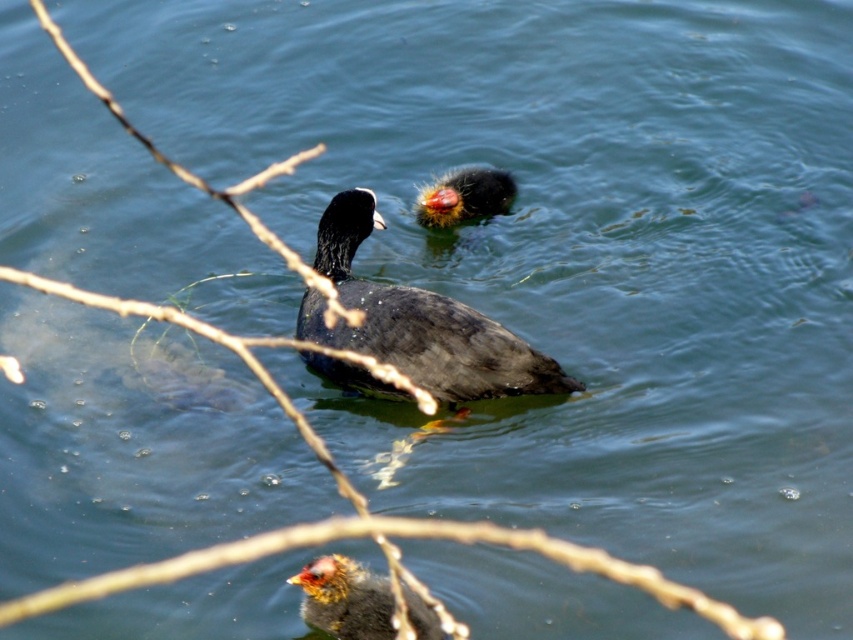
Who is positioned more to the right, matte black duck at center or fluffy black duckling at upper center?

fluffy black duckling at upper center is more to the right.

The image size is (853, 640). What do you see at coordinates (418, 323) in the screenshot?
I see `matte black duck at center` at bounding box center [418, 323].

From the picture: Who is more distant from viewer, (306, 320) or (469, 170)?

The point (469, 170) is behind.

Where is `matte black duck at center`? This screenshot has height=640, width=853. matte black duck at center is located at coordinates (418, 323).

Does matte black duck at center have a lesser height compared to brown fuzzy duckling at lower center?

In fact, matte black duck at center may be taller than brown fuzzy duckling at lower center.

Who is more distant from viewer, (372, 193) or (328, 573)?

Point (372, 193)

At what (x,y) coordinates should I click in order to perform the action: click on matte black duck at center. Please return your answer as a coordinate pair (x, y). The width and height of the screenshot is (853, 640). Looking at the image, I should click on pyautogui.click(x=418, y=323).

Does brown fuzzy duckling at lower center have a lesser height compared to fluffy black duckling at upper center?

Correct, brown fuzzy duckling at lower center is not as tall as fluffy black duckling at upper center.

Based on the photo, who is more forward, (288, 580) or (442, 188)?

Positioned in front is point (288, 580).

You are a GUI agent. You are given a task and a screenshot of the screen. Output one action in this format:
    pyautogui.click(x=<x>, y=<y>)
    Task: Click on the brown fuzzy duckling at lower center
    The image size is (853, 640).
    Given the screenshot: What is the action you would take?
    pyautogui.click(x=345, y=598)